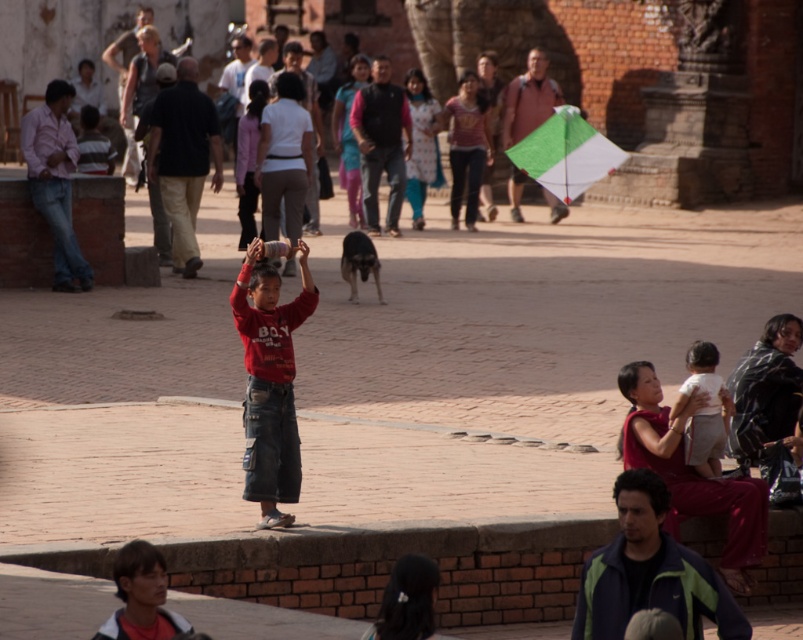
Question: Which object is closer to the camera taking this photo?

Choices:
 (A) green fabric kite at upper center
 (B) light brown fabric shirt at lower right
 (C) matte black dog at center

Answer: (B)

Question: Which point is farther from the camera taking this photo?

Choices:
 (A) (492, 44)
 (B) (601, 154)
 (C) (691, 419)
 (D) (279, 282)

Answer: (A)

Question: Can you confirm if red cotton shirt at center is positioned below green fabric kite at upper center?

Choices:
 (A) yes
 (B) no

Answer: (A)

Question: Can you confirm if matte black dog at center is positioned above light brown fabric shirt at lower right?

Choices:
 (A) yes
 (B) no

Answer: (A)

Question: Can you confirm if matte black dog at center is smaller than green fabric kite at upper center?

Choices:
 (A) no
 (B) yes

Answer: (A)

Question: Based on their relative distances, which object is nearer to the green fabric kite at upper center?

Choices:
 (A) matte black dog at center
 (B) red cotton shirt at center
 (C) light brown fabric shirt at lower right

Answer: (C)